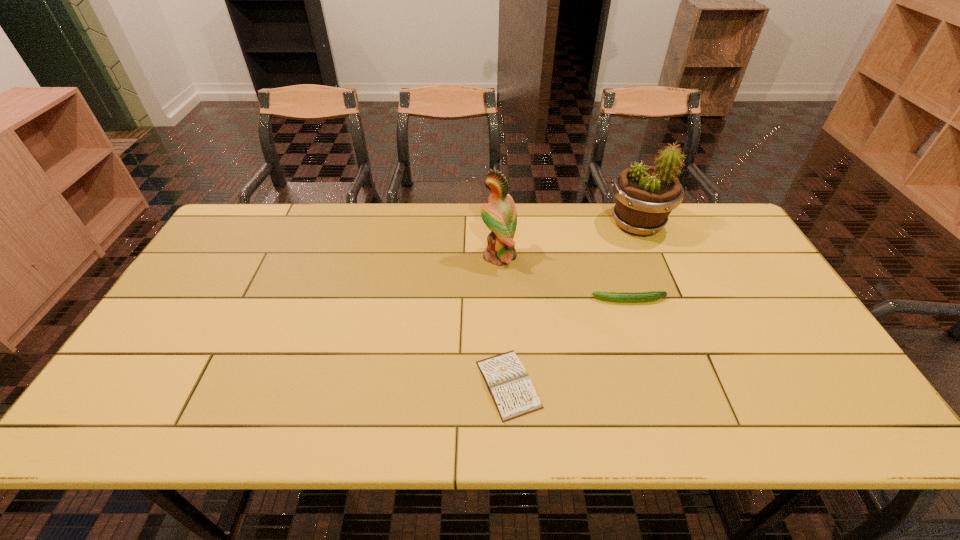
Where is `vacant space that's between the parrot and the flowerpot`? The width and height of the screenshot is (960, 540). vacant space that's between the parrot and the flowerpot is located at coordinates (568, 240).

I want to click on vacant point located between the flowerpot and the parrot, so click(568, 240).

I want to click on free spot between the nearest object and the flowerpot, so click(573, 304).

Identify which object is located as the third nearest to the diary. Please provide its 2D coordinates. Your answer should be formatted as a tuple, i.e. [(x, y)], where the tuple contains the x and y coordinates of a point satisfying the conditions above.

[(645, 195)]

Point out which object is positioned as the third nearest to the flowerpot. Please provide its 2D coordinates. Your answer should be formatted as a tuple, i.e. [(x, y)], where the tuple contains the x and y coordinates of a point satisfying the conditions above.

[(514, 395)]

This screenshot has height=540, width=960. Identify the location of free space that satisfies the following two spatial constraints: 1. on the back side of the nearest object; 2. on the front-facing side of the parrot. (501, 256).

Find the location of a particular element. blank space that satisfies the following two spatial constraints: 1. on the front-facing side of the parrot; 2. on the left side of the shortest object is located at coordinates (504, 384).

Find the location of `vacant space that satisfies the following two spatial constraints: 1. on the front-facing side of the parrot; 2. on the back side of the shortest object`. vacant space that satisfies the following two spatial constraints: 1. on the front-facing side of the parrot; 2. on the back side of the shortest object is located at coordinates (504, 384).